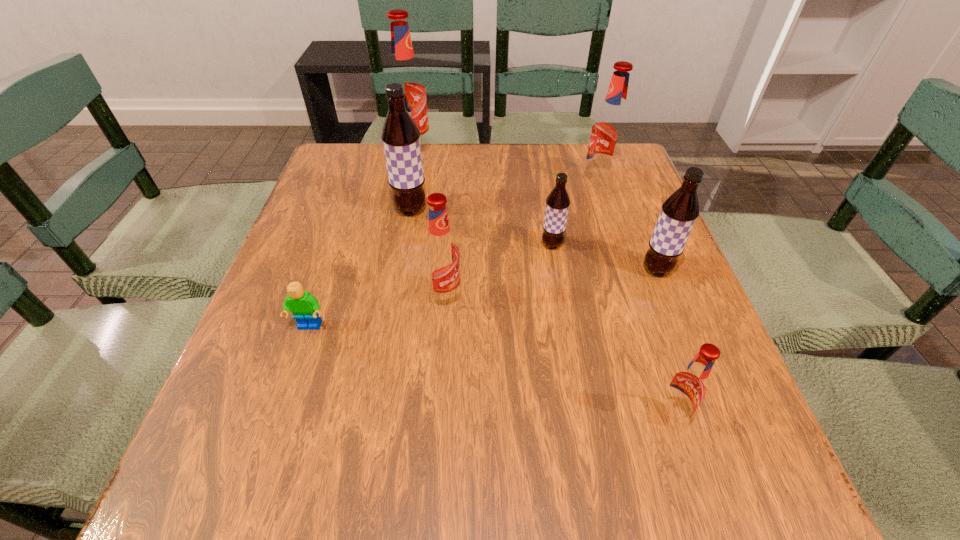
Identify the location of object that is the fourth closest to the sixth nearest root beer. Image resolution: width=960 pixels, height=540 pixels. (404, 71).

Where is `object that is the fifth closest to the third farthest object`? This screenshot has height=540, width=960. object that is the fifth closest to the third farthest object is located at coordinates coord(609,129).

The image size is (960, 540). I want to click on root beer that is the sixth closest to the leftmost object, so click(x=680, y=210).

This screenshot has width=960, height=540. Find the location of `the fifth closest root beer to the nearest object`. the fifth closest root beer to the nearest object is located at coordinates (401, 137).

Locate which red root beer ranks fourth in proximity to the second biggest brown root beer. Please provide its 2D coordinates. Your answer should be formatted as a tuple, i.e. [(x, y)], where the tuple contains the x and y coordinates of a point satisfying the conditions above.

[(404, 71)]

Identify the location of the closest red root beer to the fourth farthest root beer. (441, 257).

Identify which brown root beer is the third nearest to the farthest root beer. Please provide its 2D coordinates. Your answer should be formatted as a tuple, i.e. [(x, y)], where the tuple contains the x and y coordinates of a point satisfying the conditions above.

[(680, 210)]

Locate an element on the screen. The image size is (960, 540). the second closest brown root beer to the fourth farthest object is located at coordinates (401, 137).

The height and width of the screenshot is (540, 960). What are the coordinates of `vacant area in the image that satisfies the following two spatial constraints: 1. on the front side of the tallest root beer; 2. on the right side of the smallest brown root beer` in the screenshot? It's located at (396, 245).